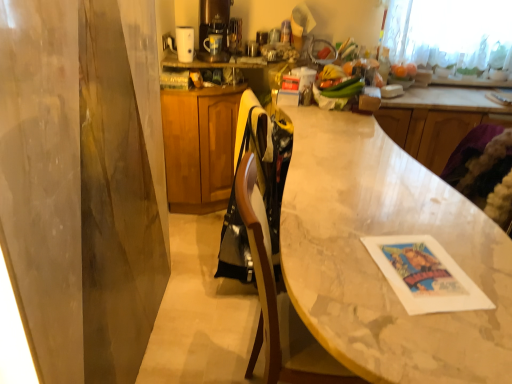
Question: Is wooden counter at upper right aimed at smooth orange fruit at upper right?

Choices:
 (A) yes
 (B) no

Answer: (B)

Question: Is wooden counter at upper right further to the viewer compared to smooth orange fruit at upper right?

Choices:
 (A) yes
 (B) no

Answer: (B)

Question: Can you confirm if wooden counter at upper right is bigger than smooth orange fruit at upper right?

Choices:
 (A) no
 (B) yes

Answer: (B)

Question: Does wooden counter at upper right have a smaller size compared to smooth orange fruit at upper right?

Choices:
 (A) no
 (B) yes

Answer: (A)

Question: Would you say smooth orange fruit at upper right is part of wooden counter at upper right's contents?

Choices:
 (A) yes
 (B) no

Answer: (B)

Question: Looking at their shapes, would you say purple fabric swivel chair at lower right is wider or thinner than wooden cabinet at center?

Choices:
 (A) thin
 (B) wide

Answer: (A)

Question: Is point (458, 170) positioned closer to the camera than point (185, 187)?

Choices:
 (A) closer
 (B) farther

Answer: (A)

Question: Based on their sizes in the image, would you say purple fabric swivel chair at lower right is bigger or smaller than wooden cabinet at center?

Choices:
 (A) big
 (B) small

Answer: (B)

Question: From their relative heights in the image, would you say purple fabric swivel chair at lower right is taller or shorter than wooden cabinet at center?

Choices:
 (A) tall
 (B) short

Answer: (B)

Question: From the image's perspective, is purple fabric swivel chair at lower right above or below smooth orange fruit at upper right?

Choices:
 (A) below
 (B) above

Answer: (A)

Question: Is point (478, 137) closer or farther from the camera than point (397, 74)?

Choices:
 (A) closer
 (B) farther

Answer: (A)

Question: Considering the positions of purple fabric swivel chair at lower right and smooth orange fruit at upper right in the image, is purple fabric swivel chair at lower right bigger or smaller than smooth orange fruit at upper right?

Choices:
 (A) big
 (B) small

Answer: (A)

Question: In the image, is purple fabric swivel chair at lower right on the left side or the right side of smooth orange fruit at upper right?

Choices:
 (A) right
 (B) left

Answer: (A)

Question: Based on their sizes in the image, would you say satin gold coffee machine at upper center is bigger or smaller than smooth orange fruit at upper right?

Choices:
 (A) big
 (B) small

Answer: (A)

Question: Considering the positions of point (223, 4) and point (415, 66), is point (223, 4) closer or farther from the camera than point (415, 66)?

Choices:
 (A) closer
 (B) farther

Answer: (A)